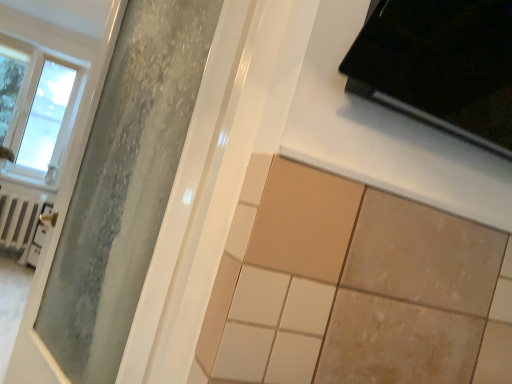
Measure the distance between white glossy window at upper left and camera.

A distance of 11.78 feet exists between white glossy window at upper left and camera.

This screenshot has width=512, height=384. What are the coordinates of `white glossy window at upper left` in the screenshot? It's located at (54, 85).

What do you see at coordinates (54, 85) in the screenshot?
I see `white glossy window at upper left` at bounding box center [54, 85].

Where is `white glossy window at upper left`? The image size is (512, 384). white glossy window at upper left is located at coordinates (54, 85).